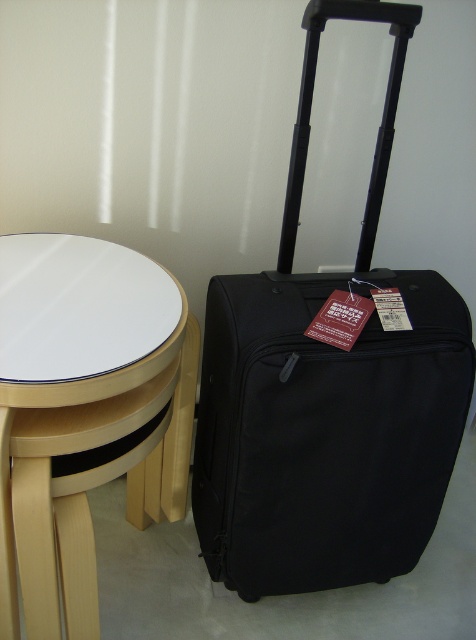
Is black hardshell suitcase at right bigger than light wood side table at lower left?

Yes, black hardshell suitcase at right is bigger than light wood side table at lower left.

Who is more distant from viewer, [241,550] or [66,376]?

The point [241,550] is more distant.

Locate an element on the screen. The image size is (476, 640). black hardshell suitcase at right is located at coordinates (327, 394).

In the scene shown: Does black hardshell suitcase at right appear on the right side of white glossy table at center?

Correct, you'll find black hardshell suitcase at right to the right of white glossy table at center.

Does point (359, 412) come farther from viewer compared to point (158, 353)?

Yes, point (359, 412) is farther from viewer.

Does point (205, 336) come farther from viewer compared to point (59, 314)?

Yes.

At what (x,y) coordinates should I click in order to perform the action: click on black hardshell suitcase at right. Please return your answer as a coordinate pair (x, y). Looking at the image, I should click on (327, 394).

Does light wood side table at lower left lie in front of white glossy table at center?

Yes, it is in front of white glossy table at center.

The width and height of the screenshot is (476, 640). What do you see at coordinates (75, 408) in the screenshot? I see `light wood side table at lower left` at bounding box center [75, 408].

Find the location of a particular element. light wood side table at lower left is located at coordinates (75, 408).